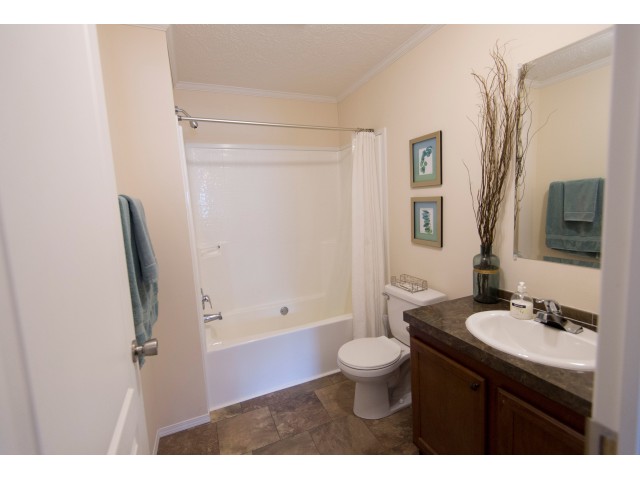
The image size is (640, 480). In order to click on walls in this screenshot , I will do `click(154, 124)`, `click(244, 106)`, `click(448, 102)`.